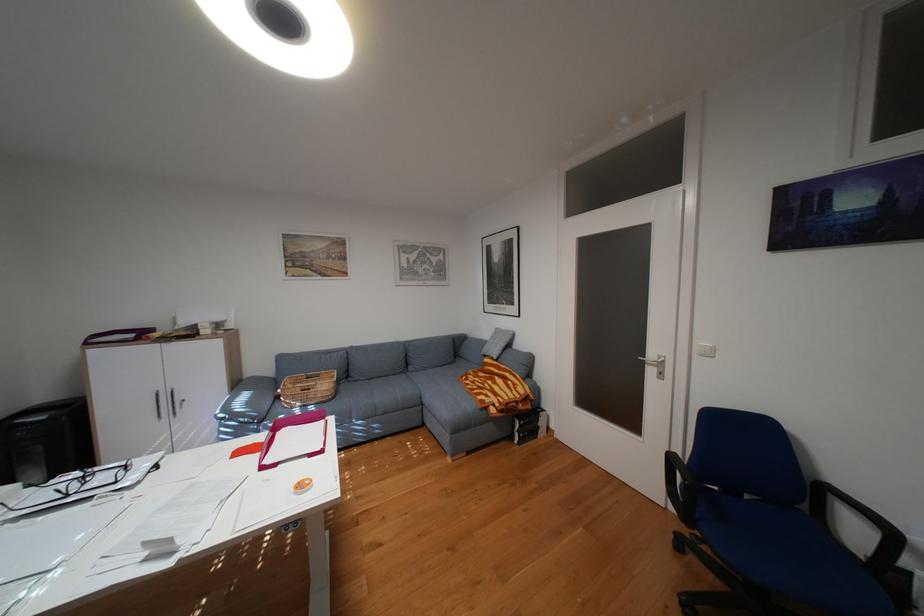
Image resolution: width=924 pixels, height=616 pixels. Describe the element at coordinates (706, 350) in the screenshot. I see `a white light switch` at that location.